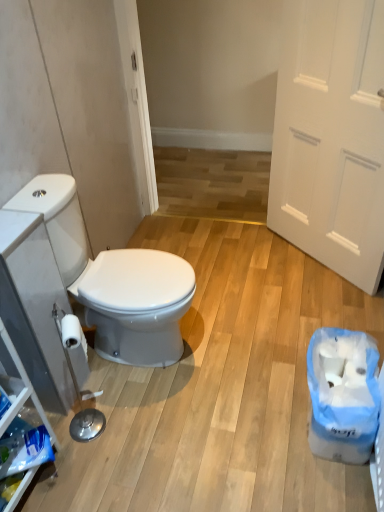
The image size is (384, 512). I want to click on free spot to the right of white glossy toilet seat at left, so click(237, 344).